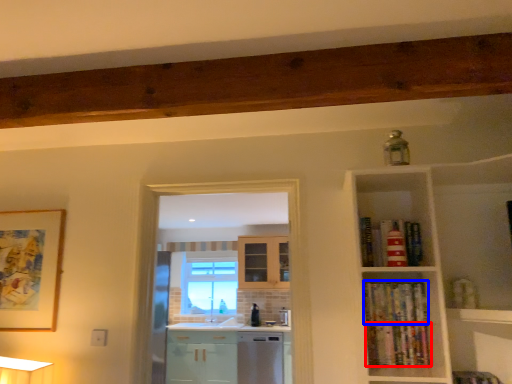
Question: Among these objects, which one is farthest to the camera, book (highlighted by a red box) or book (highlighted by a blue box)?

Choices:
 (A) book
 (B) book

Answer: (B)